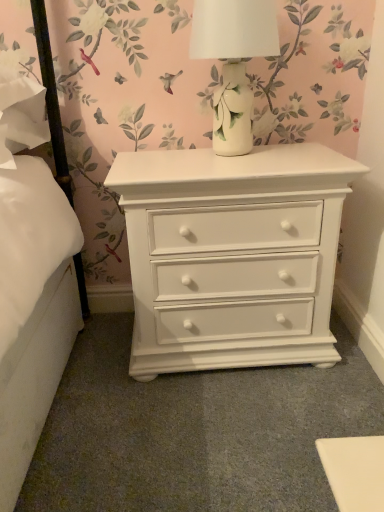
Locate an element on the screen. This screenshot has width=384, height=512. vacant space situated above white painted wood nightstand at center (from a real-world perspective) is located at coordinates point(230,150).